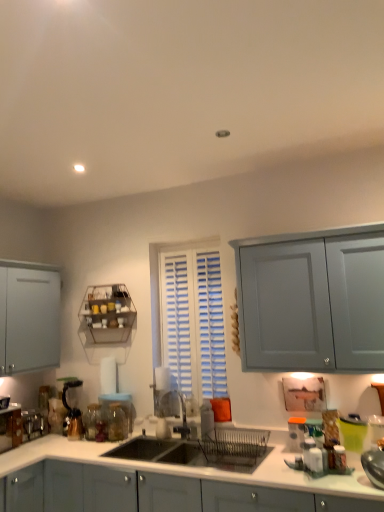
Question: Considering the positions of matte black coffee machine at lower left and matte plastic container at right, which is the 2th appliance from back to front, in the image, is matte black coffee machine at lower left wider or thinner than matte plastic container at right, which is the 2th appliance from back to front,?

Choices:
 (A) wide
 (B) thin

Answer: (A)

Question: Considering the positions of matte black coffee machine at lower left and matte plastic container at right, the 2th appliance when ordered from front to back, in the image, is matte black coffee machine at lower left taller or shorter than matte plastic container at right, the 2th appliance when ordered from front to back,?

Choices:
 (A) tall
 (B) short

Answer: (A)

Question: Estimate the real-world distances between objects in this image. Which object is farther from the transparent glass jar at lower left, the second glass jar viewed from the right?

Choices:
 (A) transparent glass jar at sink, the second glass jar positioned from the left
 (B) matte plastic container at right, the 3th appliance positioned from the left
 (C) matte gray cabinets at center
 (D) metallic wire rack at upper left
 (E) metallic silver toaster at lower left, which is the 1th appliance in left-to-right order

Answer: (B)

Question: Based on their relative distances, which object is nearer to the transparent glass jar at sink, the 1th glass jar viewed from the right?

Choices:
 (A) transparent glass jar at lower left, which appears as the first glass jar when viewed from the left
 (B) matte black coffee machine at lower left
 (C) metallic wire rack at upper left
 (D) matte plastic container at right, the 3th appliance positioned from the left
 (E) white glossy salt shaker at lower right, the 2th appliance in the left-to-right sequence

Answer: (A)